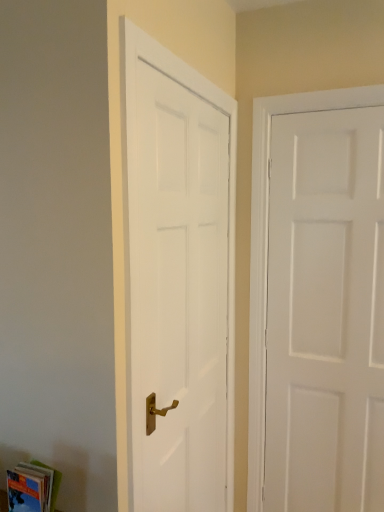
Question: Considering the relative positions of white smooth door at left, placed as the 1th door when sorted from left to right, and hardcover book at lower left in the image provided, is white smooth door at left, placed as the 1th door when sorted from left to right, behind hardcover book at lower left?

Choices:
 (A) yes
 (B) no

Answer: (A)

Question: Is white smooth door at left, which is counted as the second door, starting from the right, aimed at hardcover book at lower left?

Choices:
 (A) no
 (B) yes

Answer: (A)

Question: Is white smooth door at left, which is counted as the second door, starting from the right, not near hardcover book at lower left?

Choices:
 (A) yes
 (B) no

Answer: (B)

Question: Is white smooth door at left, which is counted as the second door, starting from the right, positioned before hardcover book at lower left?

Choices:
 (A) no
 (B) yes

Answer: (A)

Question: Can hardcover book at lower left be found inside white smooth door at left, placed as the 1th door when sorted from left to right?

Choices:
 (A) yes
 (B) no

Answer: (B)

Question: Does white smooth door at left, placed as the 1th door when sorted from left to right, have a greater height compared to hardcover book at lower left?

Choices:
 (A) no
 (B) yes

Answer: (B)

Question: Does white matte door at right, the 1th door in the right-to-left sequence, have a lesser height compared to hardcover book at lower left?

Choices:
 (A) yes
 (B) no

Answer: (B)

Question: From a real-world perspective, is white matte door at right, the 2th door viewed from the left, positioned over hardcover book at lower left based on gravity?

Choices:
 (A) yes
 (B) no

Answer: (A)

Question: Is the position of white matte door at right, the 1th door in the right-to-left sequence, less distant than that of hardcover book at lower left?

Choices:
 (A) no
 (B) yes

Answer: (A)

Question: Is white matte door at right, the 2th door viewed from the left, turned away from hardcover book at lower left?

Choices:
 (A) yes
 (B) no

Answer: (B)

Question: Is white matte door at right, the 2th door viewed from the left, wider than hardcover book at lower left?

Choices:
 (A) no
 (B) yes

Answer: (B)

Question: Does white matte door at right, the 2th door viewed from the left, have a greater height compared to hardcover book at lower left?

Choices:
 (A) yes
 (B) no

Answer: (A)

Question: Does hardcover book at lower left have a lesser width compared to white matte door at right, the 1th door in the right-to-left sequence?

Choices:
 (A) no
 (B) yes

Answer: (B)